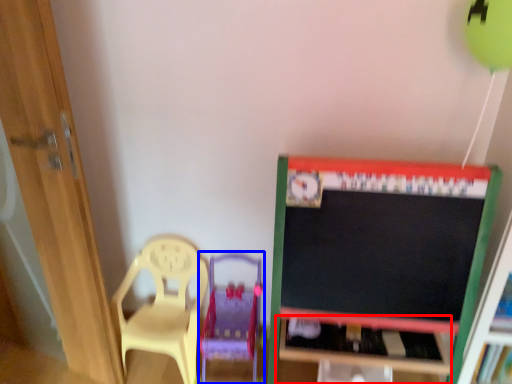
Question: Which object appears farthest to the camera in this image, table (highlighted by a red box) or swivel chair (highlighted by a blue box)?

Choices:
 (A) table
 (B) swivel chair

Answer: (A)